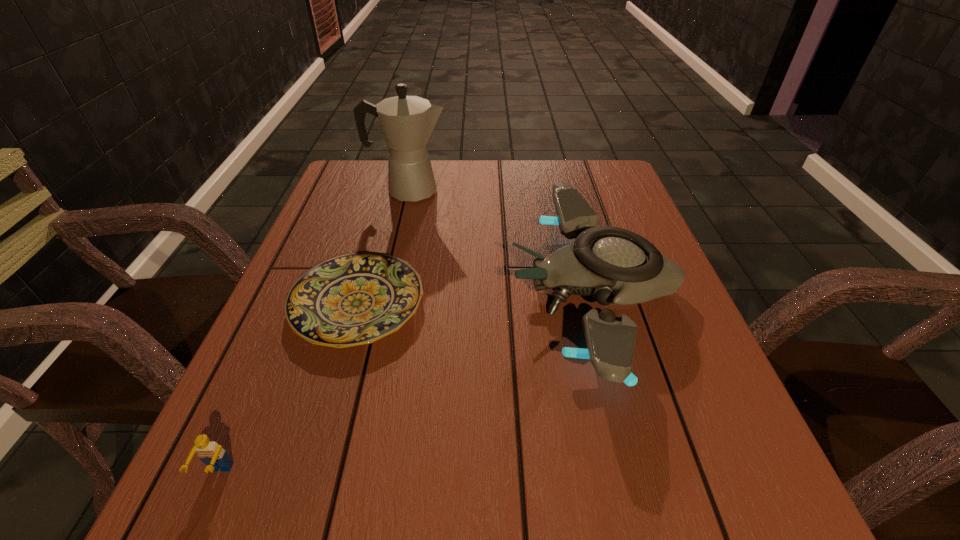
Find the location of a particular element. vacant area that lies between the plate and the Lego is located at coordinates (288, 389).

Where is `free space between the drone and the tallest object`? free space between the drone and the tallest object is located at coordinates (501, 240).

What are the coordinates of `free point between the second tallest object and the nearest object` in the screenshot? It's located at (406, 382).

The height and width of the screenshot is (540, 960). I want to click on vacant area that lies between the drone and the Lego, so click(406, 382).

This screenshot has height=540, width=960. Find the location of `free spot between the third tallest object and the rightmost object`. free spot between the third tallest object and the rightmost object is located at coordinates (406, 382).

Select which object appears as the closest to the Lego. Please provide its 2D coordinates. Your answer should be formatted as a tuple, i.e. [(x, y)], where the tuple contains the x and y coordinates of a point satisfying the conditions above.

[(353, 299)]

Locate which object ranks in proximity to the tallest object. Please provide its 2D coordinates. Your answer should be formatted as a tuple, i.e. [(x, y)], where the tuple contains the x and y coordinates of a point satisfying the conditions above.

[(614, 265)]

Where is `free space in the image that satisfies the following two spatial constraints: 1. on the front-facing side of the rightmost object; 2. on the face of the Lego`? free space in the image that satisfies the following two spatial constraints: 1. on the front-facing side of the rightmost object; 2. on the face of the Lego is located at coordinates (645, 475).

Find the location of a particular element. Image resolution: width=960 pixels, height=540 pixels. free spot that satisfies the following two spatial constraints: 1. on the front-facing side of the drone; 2. on the face of the third tallest object is located at coordinates (645, 475).

The image size is (960, 540). In order to click on blank area in the image that satisfies the following two spatial constraints: 1. on the front-facing side of the third shortest object; 2. on the front side of the shortest object in this screenshot , I will do `click(598, 304)`.